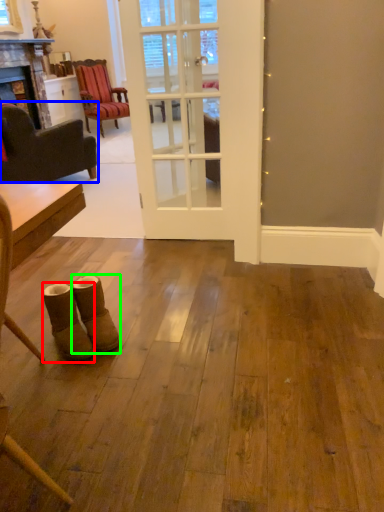
Question: Which is farther away from footwear (highlighted by a red box)? chair (highlighted by a blue box) or footwear (highlighted by a green box)?

Choices:
 (A) chair
 (B) footwear

Answer: (A)